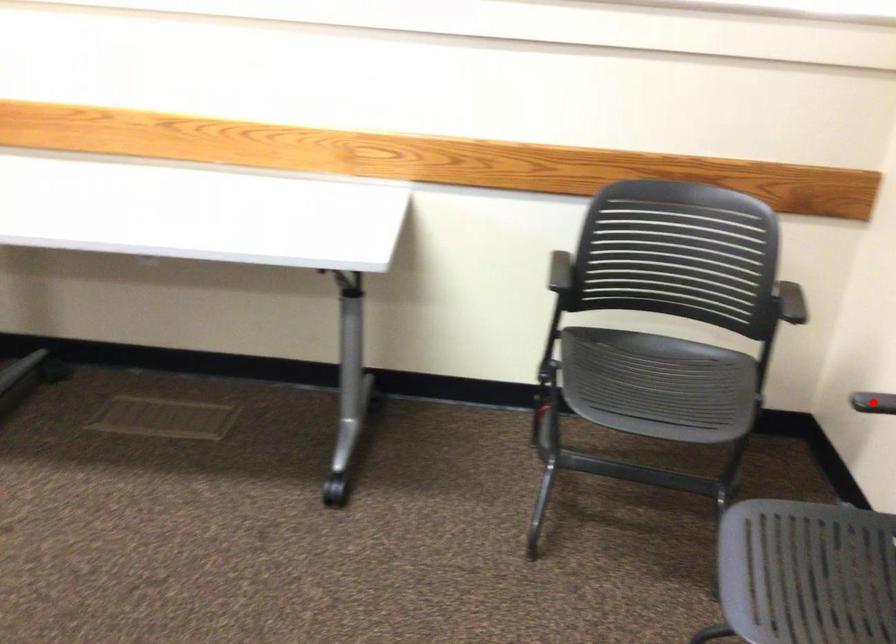
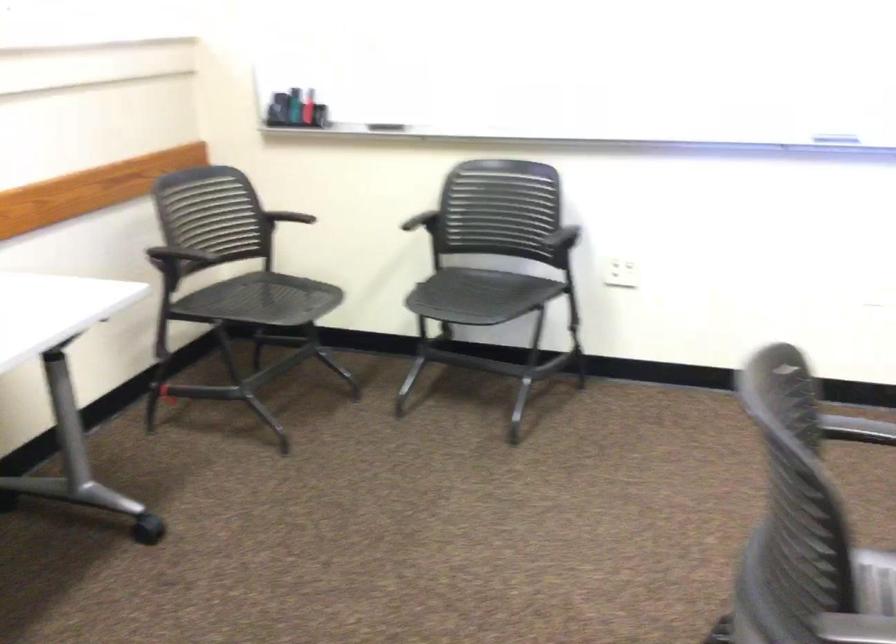
Question: I am providing you with two images of the same scene from different viewpoints. A red point is marked on the first image. Is the red point's position out of view in image 2?

Choices:
 (A) Yes
 (B) No

Answer: (B)